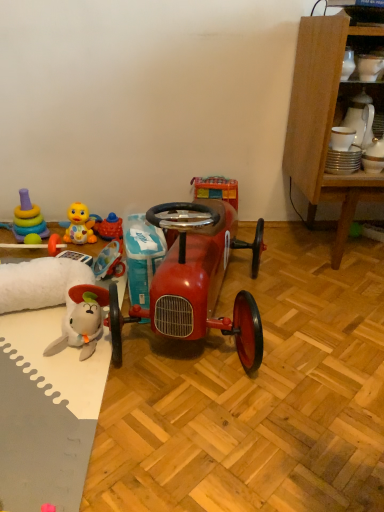
Locate an element on the screen. This screenshot has width=384, height=512. free point below wooden cabinet at right (from a real-world perspective) is located at coordinates (348, 249).